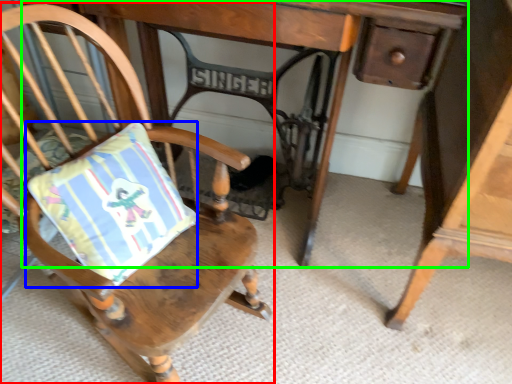
Question: Which is farther away from chair (highlighted by a red box)? pillow (highlighted by a blue box) or table (highlighted by a green box)?

Choices:
 (A) pillow
 (B) table

Answer: (B)